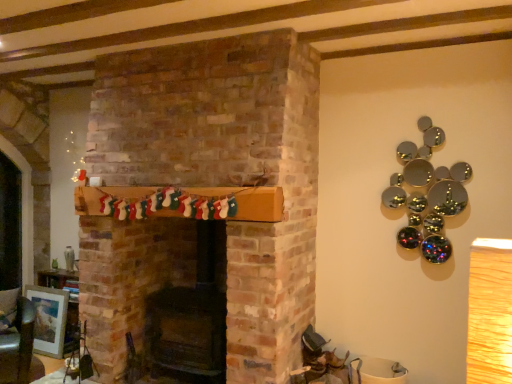
Question: Does green leather armchair at lower left have a lesser width compared to matte silver picture frame at lower left?

Choices:
 (A) no
 (B) yes

Answer: (A)

Question: Is green leather armchair at lower left behind matte silver picture frame at lower left?

Choices:
 (A) no
 (B) yes

Answer: (A)

Question: Does green leather armchair at lower left have a smaller size compared to matte silver picture frame at lower left?

Choices:
 (A) no
 (B) yes

Answer: (A)

Question: Are green leather armchair at lower left and matte silver picture frame at lower left located far from each other?

Choices:
 (A) yes
 (B) no

Answer: (B)

Question: Is green leather armchair at lower left facing away from matte silver picture frame at lower left?

Choices:
 (A) yes
 (B) no

Answer: (A)

Question: From the image's perspective, is green leather armchair at lower left beneath matte silver picture frame at lower left?

Choices:
 (A) yes
 (B) no

Answer: (B)

Question: From a real-world perspective, is matte silver picture frame at lower left positioned under green leather armchair at lower left based on gravity?

Choices:
 (A) yes
 (B) no

Answer: (A)

Question: Is matte silver picture frame at lower left bigger than green leather armchair at lower left?

Choices:
 (A) no
 (B) yes

Answer: (A)

Question: From the image's perspective, is matte silver picture frame at lower left located beneath green leather armchair at lower left?

Choices:
 (A) no
 (B) yes

Answer: (B)

Question: Is matte silver picture frame at lower left shorter than green leather armchair at lower left?

Choices:
 (A) yes
 (B) no

Answer: (A)

Question: Considering the relative positions of matte silver picture frame at lower left and green leather armchair at lower left in the image provided, is matte silver picture frame at lower left to the left of green leather armchair at lower left from the viewer's perspective?

Choices:
 (A) yes
 (B) no

Answer: (A)

Question: Does matte silver picture frame at lower left lie behind green leather armchair at lower left?

Choices:
 (A) no
 (B) yes

Answer: (B)

Question: Would you say matte silver picture frame at lower left is to the left or to the right of green leather armchair at lower left in the picture?

Choices:
 (A) right
 (B) left

Answer: (B)